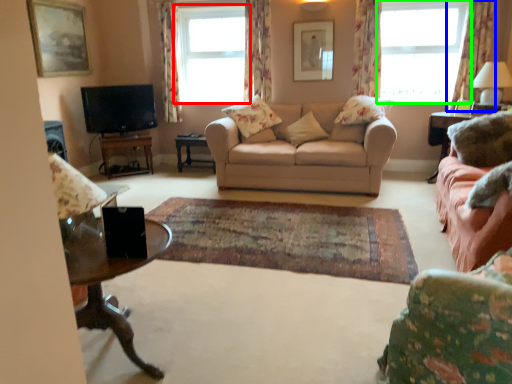
Question: Which object is the farthest from window (highlighted by a red box)? Choose among these: curtain (highlighted by a blue box) or window (highlighted by a green box).

Choices:
 (A) curtain
 (B) window

Answer: (A)